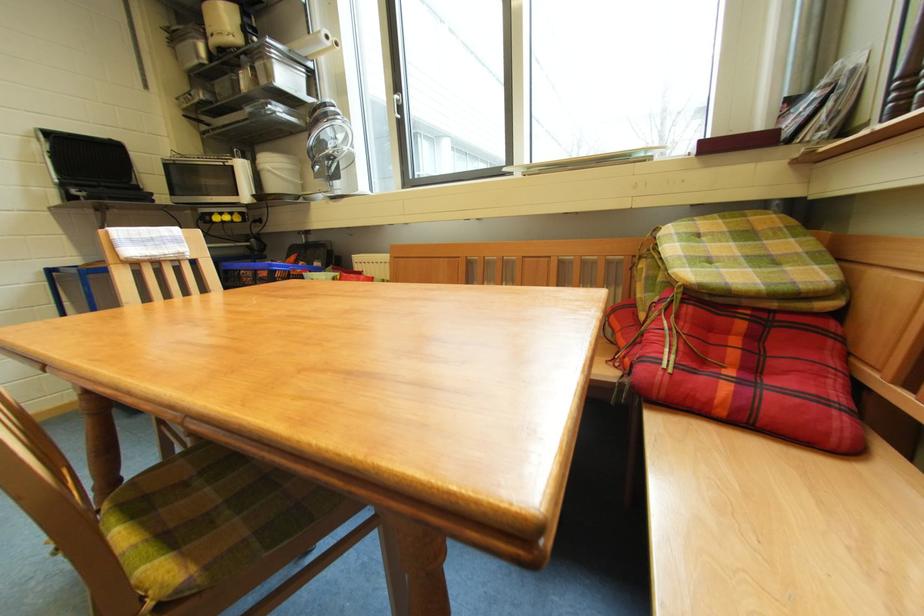
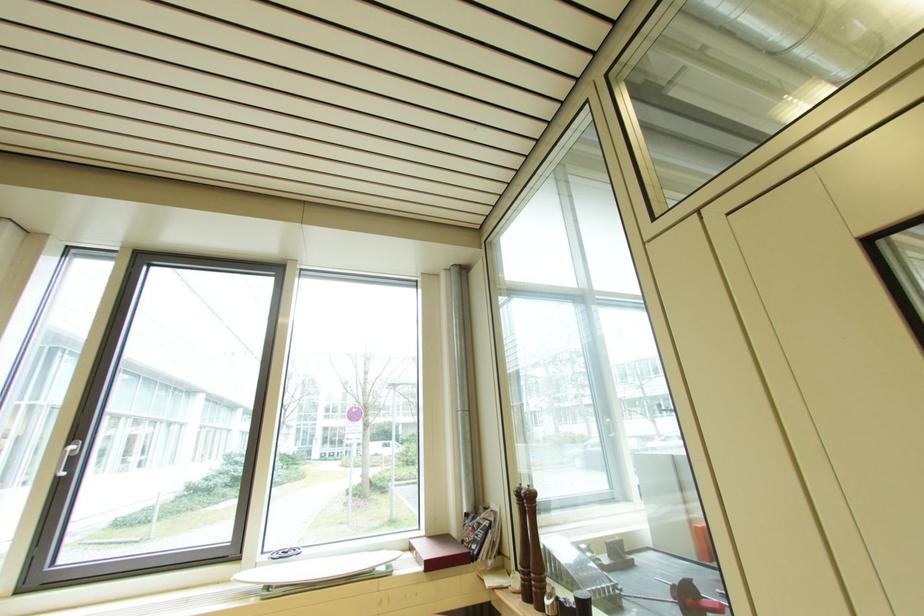
In the second image, find the point that corresponds to [402,102] in the first image.

(73, 455)